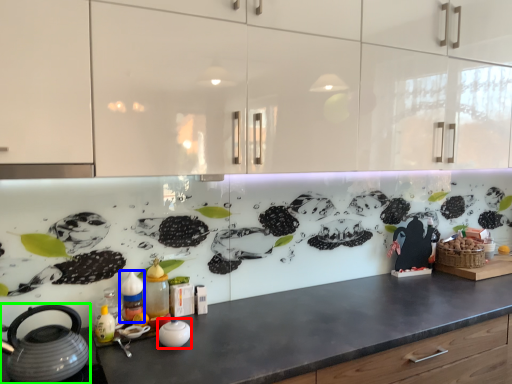
Question: Which object is positioned closest to appliance (highlighted by a red box)? Select from bottle (highlighted by a blue box) and kettle (highlighted by a green box).

Choices:
 (A) bottle
 (B) kettle

Answer: (A)